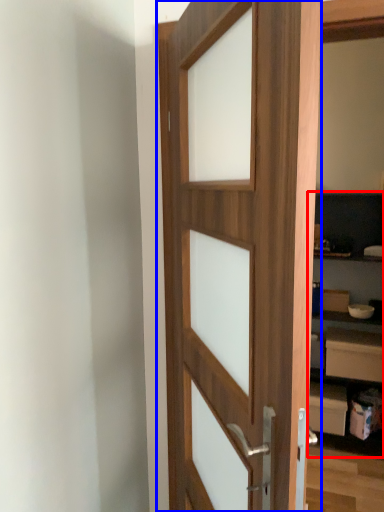
Question: Which point is further to the camera, bookshelf (highlighted by a red box) or door (highlighted by a blue box)?

Choices:
 (A) bookshelf
 (B) door

Answer: (A)